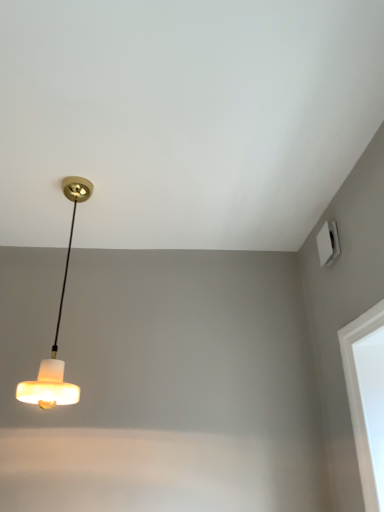
Image resolution: width=384 pixels, height=512 pixels. Identify the location of white frosted glass lampshade at upper left. (57, 329).

This screenshot has width=384, height=512. What do you see at coordinates (57, 329) in the screenshot?
I see `white frosted glass lampshade at upper left` at bounding box center [57, 329].

At what (x,y) coordinates should I click in order to perform the action: click on white frosted glass lampshade at upper left. Please return your answer as a coordinate pair (x, y). Looking at the image, I should click on pyautogui.click(x=57, y=329).